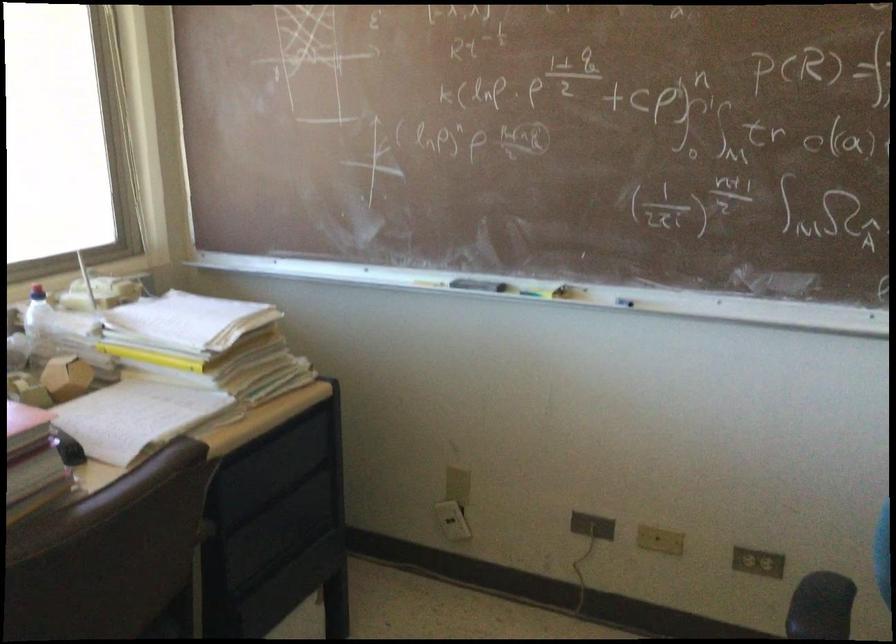
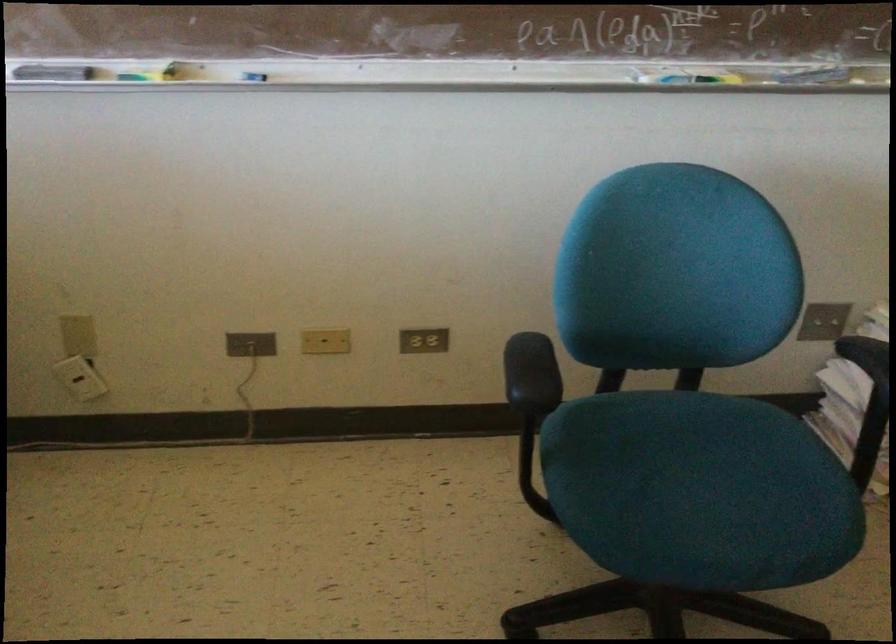
Find the pixel in the second image that matches the point at 755,564 in the first image.

(423, 341)